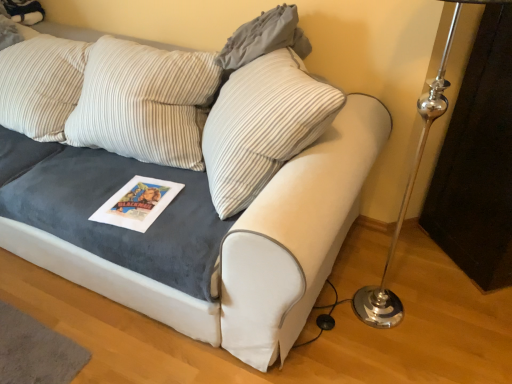
Describe the element at coordinates (203, 208) in the screenshot. I see `velvet gray couch at center` at that location.

Measure the distance between point (x=265, y=368) and camera.

They are 4.66 feet apart.

Locate an element on the screen. Image resolution: width=512 pixels, height=384 pixels. velvet gray couch at center is located at coordinates (203, 208).

The height and width of the screenshot is (384, 512). Describe the element at coordinates (264, 38) in the screenshot. I see `gray fabric pillow at upper center` at that location.

The image size is (512, 384). I want to click on gray fabric pillow at upper center, so click(x=264, y=38).

Find the location of a particular element. The image size is (512, 384). velvet gray couch at center is located at coordinates (203, 208).

Is gray fabric pillow at upper center to the left of velvet gray couch at center from the viewer's perspective?

Incorrect, gray fabric pillow at upper center is not on the left side of velvet gray couch at center.

Does gray fabric pillow at upper center lie behind velvet gray couch at center?

That is True.

From the picture: Which point is more forward, (262,30) or (259,273)?

The point (259,273) is in front.

Consider the image. From the image's perspective, is gray fabric pillow at upper center on velvet gray couch at center?

Yes, from the image's perspective, gray fabric pillow at upper center is over velvet gray couch at center.

From a real-world perspective, which object stands above the other?

In real-world perspective, gray fabric pillow at upper center is above.

In terms of width, does gray fabric pillow at upper center look wider or thinner when compared to velvet gray couch at center?

Considering their sizes, gray fabric pillow at upper center looks slimmer than velvet gray couch at center.

Considering the sizes of gray fabric pillow at upper center and velvet gray couch at center in the image, is gray fabric pillow at upper center taller or shorter than velvet gray couch at center?

Considering their sizes, gray fabric pillow at upper center has less height than velvet gray couch at center.

Can you confirm if gray fabric pillow at upper center is bigger than velvet gray couch at center?

Actually, gray fabric pillow at upper center might be smaller than velvet gray couch at center.

Do you think gray fabric pillow at upper center is within velvet gray couch at center, or outside of it?

gray fabric pillow at upper center exists outside the volume of velvet gray couch at center.

Based on the photo, are gray fabric pillow at upper center and velvet gray couch at center far apart?

No, there isn't a large distance between gray fabric pillow at upper center and velvet gray couch at center.

Looking at this image, does gray fabric pillow at upper center turn towards velvet gray couch at center?

No, gray fabric pillow at upper center is not facing towards velvet gray couch at center.

Find the location of `studio couch on the left of gray fabric pillow at upper center`. studio couch on the left of gray fabric pillow at upper center is located at coordinates (203, 208).

Looking at this image, is velvet gray couch at center to the left or to the right of gray fabric pillow at upper center in the image?

In the image, velvet gray couch at center appears on the left side of gray fabric pillow at upper center.

Is the position of velvet gray couch at center more distant than that of gray fabric pillow at upper center?

No, it is in front of gray fabric pillow at upper center.

Does point (161, 170) lie in front of point (249, 61)?

No, it is not.

From the image's perspective, between velvet gray couch at center and gray fabric pillow at upper center, who is located below?

velvet gray couch at center, from the image's perspective.

From a real-world perspective, is velvet gray couch at center positioned above or below gray fabric pillow at upper center?

velvet gray couch at center is below gray fabric pillow at upper center.

Which of these two, velvet gray couch at center or gray fabric pillow at upper center, is thinner?

Thinner between the two is gray fabric pillow at upper center.

Consider the image. Between velvet gray couch at center and gray fabric pillow at upper center, which one has less height?

With less height is gray fabric pillow at upper center.

From the picture: Is velvet gray couch at center bigger than gray fabric pillow at upper center?

Yes.

Would you say velvet gray couch at center contains gray fabric pillow at upper center?

No, gray fabric pillow at upper center is not surrounded by velvet gray couch at center.

Are velvet gray couch at center and gray fabric pillow at upper center beside each other?

No, velvet gray couch at center is not making contact with gray fabric pillow at upper center.

Is velvet gray couch at center facing away from gray fabric pillow at upper center?

No, velvet gray couch at center is not facing away from gray fabric pillow at upper center.

I want to click on pillow on the right of velvet gray couch at center, so click(x=264, y=38).

Where is `studio couch lying in front of the gray fabric pillow at upper center`? The width and height of the screenshot is (512, 384). studio couch lying in front of the gray fabric pillow at upper center is located at coordinates (203, 208).

The width and height of the screenshot is (512, 384). Find the location of `pillow on the right side of velvet gray couch at center`. pillow on the right side of velvet gray couch at center is located at coordinates (264, 38).